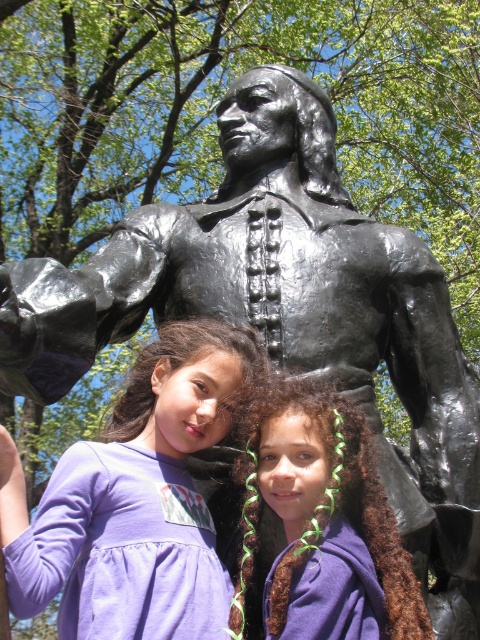
Question: Is purple fabric shirt at lower center wider than brown curly hair at center?

Choices:
 (A) no
 (B) yes

Answer: (B)

Question: Observing the image, what is the correct spatial positioning of purple fabric shirt at lower center in reference to brown curly hair at center?

Choices:
 (A) right
 (B) left

Answer: (B)

Question: Is purple fabric shirt at lower center to the left of brown curly hair at center from the viewer's perspective?

Choices:
 (A) no
 (B) yes

Answer: (B)

Question: Which point appears closest to the camera in this image?

Choices:
 (A) (340, 454)
 (B) (160, 572)

Answer: (B)